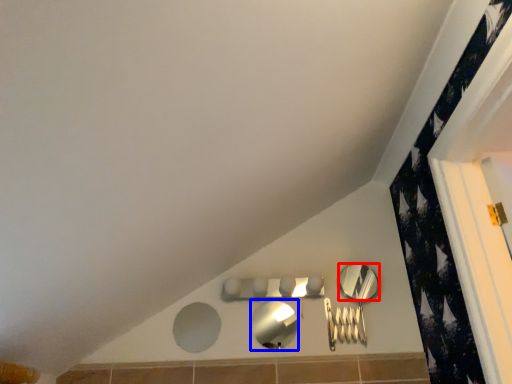
Question: Which of the following is the farthest to the observer, mirror (highlighted by a red box) or mirror (highlighted by a blue box)?

Choices:
 (A) mirror
 (B) mirror

Answer: (A)